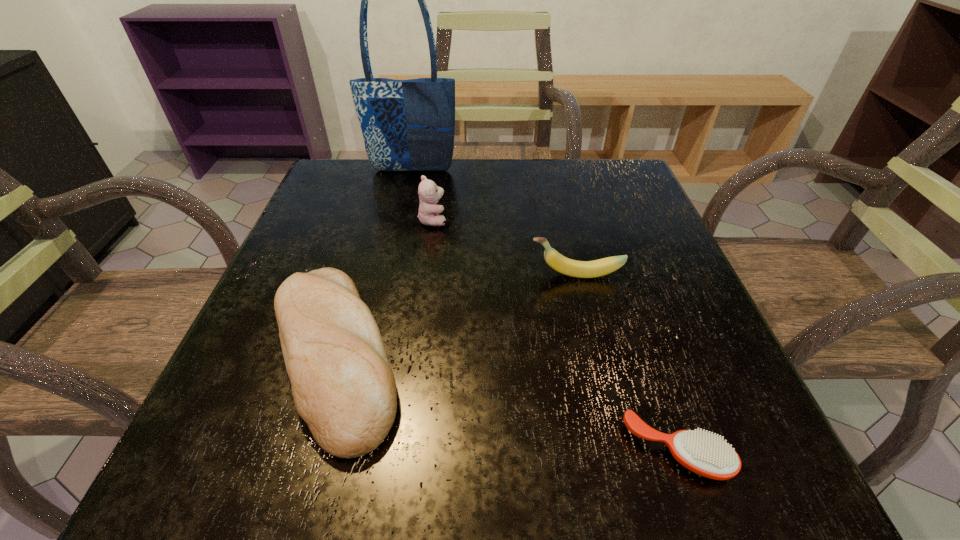
You are a GUI agent. You are given a task and a screenshot of the screen. Output one action in this format:
    pyautogui.click(x=<x>, y=<y>)
    Task: Click on the vacant point located 0.070m at the stem of the banana
    This screenshot has width=960, height=540.
    Given the screenshot: What is the action you would take?
    pyautogui.click(x=492, y=275)

Where is `vacant space located 0.390m on the back of the bread`? vacant space located 0.390m on the back of the bread is located at coordinates (388, 171).

This screenshot has width=960, height=540. In order to click on vacant space located 0.080m on the left of the hairbrush in this screenshot , I will do `click(564, 450)`.

Where is `shopping bag present at the far edge`? shopping bag present at the far edge is located at coordinates (408, 125).

Image resolution: width=960 pixels, height=540 pixels. Find the location of `teddy bear at the far edge`. teddy bear at the far edge is located at coordinates (429, 193).

At what (x,y) coordinates should I click in order to perform the action: click on bread at the near edge. Please return your answer as a coordinate pair (x, y). The width and height of the screenshot is (960, 540). Looking at the image, I should click on (343, 386).

Locate an element on the screen. Image resolution: width=960 pixels, height=540 pixels. hairbrush that is positioned at the near edge is located at coordinates (705, 454).

Where is `shopping bag at the left edge`? The height and width of the screenshot is (540, 960). shopping bag at the left edge is located at coordinates (408, 125).

Where is `bread that is at the left edge`? The image size is (960, 540). bread that is at the left edge is located at coordinates (343, 386).

Locate an element on the screen. The width and height of the screenshot is (960, 540). banana at the right edge is located at coordinates pyautogui.click(x=580, y=269).